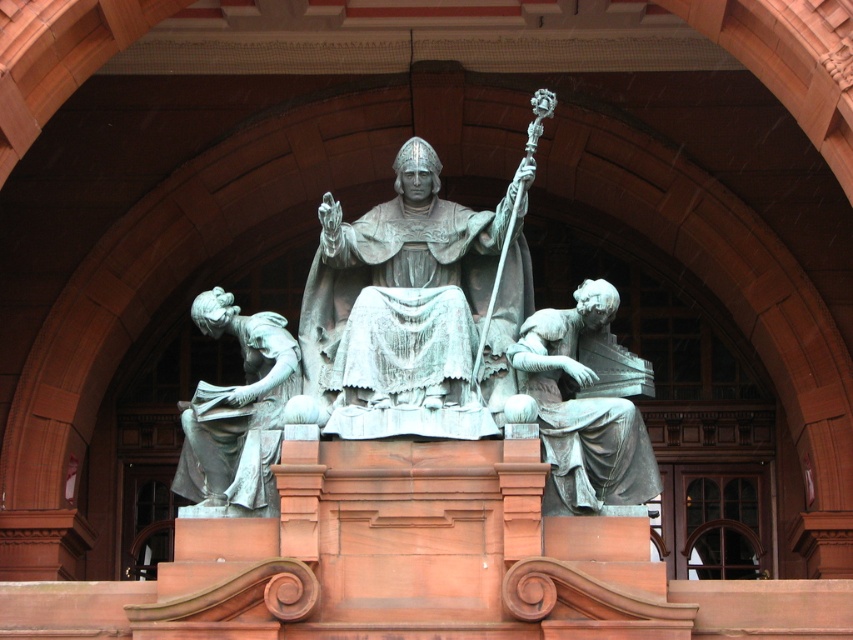
Question: Is bronze statue at center smaller than green patina statue at lower right?

Choices:
 (A) no
 (B) yes

Answer: (A)

Question: Is bronze statue at center above green patina statue at lower right?

Choices:
 (A) no
 (B) yes

Answer: (B)

Question: Is bronze statue at center wider than green patina statue at left?

Choices:
 (A) no
 (B) yes

Answer: (B)

Question: Which object is farther from the camera taking this photo?

Choices:
 (A) bronze statue at center
 (B) green patina statue at lower right
 (C) green patina statue at left

Answer: (C)

Question: Among these objects, which one is farthest from the camera?

Choices:
 (A) green patina statue at lower right
 (B) bronze statue at center
 (C) green patina statue at left

Answer: (C)

Question: Which is nearer to the green patina statue at lower right?

Choices:
 (A) green patina statue at left
 (B) bronze statue at center

Answer: (B)